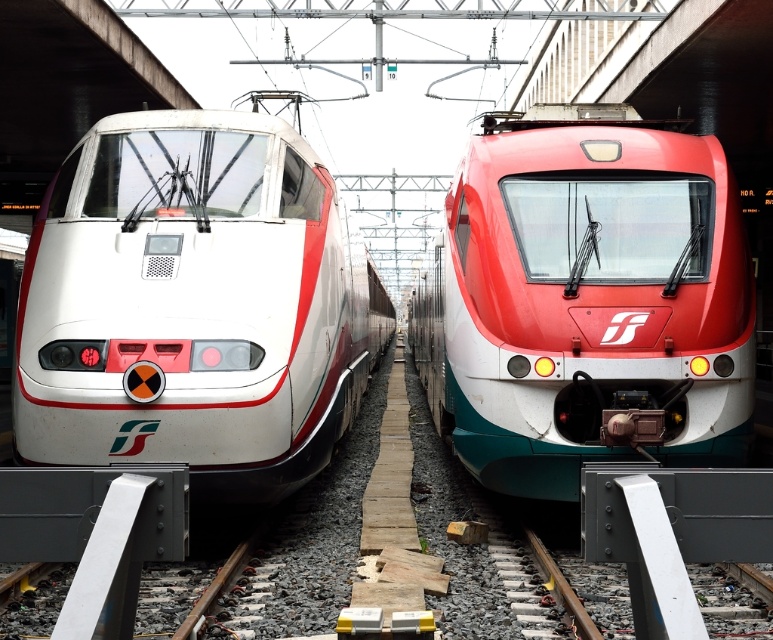
You are a railway inspector checking the alignment of two trains in a rail yard. You see the white glossy train at left and the matte red train at center. Which train is positioned further to the east if the tracks are oriented north to south?

The white glossy train at left is positioned further to the east because it is to the left of the matte red train at center, and since the tracks run north to south, the left side would correspond to the eastern direction.

You are a maintenance worker standing on the platform. You need to inspect both the white glossy train at left and the matte red train at center. Which train should you start inspecting first if you want to check the one that is higher up first?

The white glossy train at left is above the matte red train at center, so you should start inspecting the white glossy train at left first.